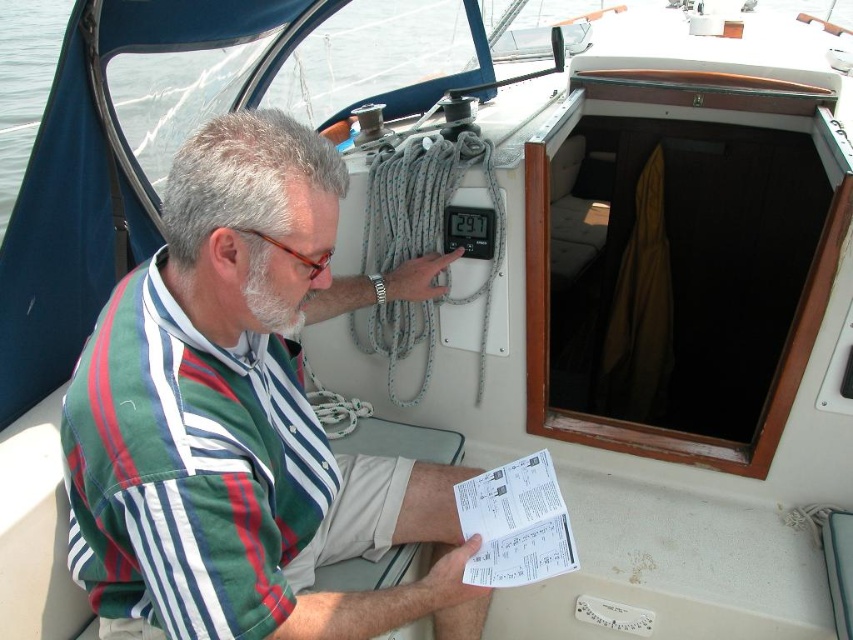
Question: Does green striped shirt at center have a smaller size compared to white paper at lower center?

Choices:
 (A) yes
 (B) no

Answer: (B)

Question: Which point is farther to the camera?

Choices:
 (A) (509, 538)
 (B) (260, 364)

Answer: (A)

Question: Does green striped shirt at center appear over white paper at lower center?

Choices:
 (A) no
 (B) yes

Answer: (B)

Question: Does green striped shirt at center lie in front of white paper at lower center?

Choices:
 (A) no
 (B) yes

Answer: (B)

Question: Among these points, which one is nearest to the camera?

Choices:
 (A) (514, 531)
 (B) (291, 573)

Answer: (A)